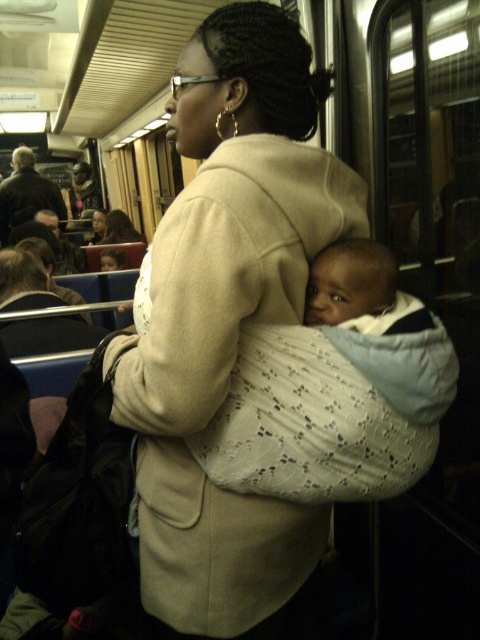
Which is behind, point (8, 214) or point (120, 227)?

The point (120, 227) is behind.

From the picture: Measure the distance between point (3, 196) and camera.

5.16 meters

This screenshot has height=640, width=480. In order to click on matte black backpack at upper left in this screenshot , I will do `click(25, 193)`.

Can you confirm if beige fabric baby carrier at center is wider than matte beige coat at center?

In fact, beige fabric baby carrier at center might be narrower than matte beige coat at center.

Who is higher up, beige fabric baby carrier at center or matte beige coat at center?

Positioned higher is matte beige coat at center.

Who is more forward, (154, 435) or (119, 216)?

Point (154, 435) is more forward.

Where is `beige fabric baby carrier at center`? beige fabric baby carrier at center is located at coordinates (229, 324).

Does point (170, 508) come closer to viewer compared to point (8, 216)?

Yes, point (170, 508) is in front of point (8, 216).

Can you confirm if beige fabric baby carrier at center is positioned to the right of matte black backpack at upper left?

Indeed, beige fabric baby carrier at center is positioned on the right side of matte black backpack at upper left.

Which is behind, point (310, 196) or point (49, 184)?

Point (49, 184)

In order to click on beige fabric baby carrier at center in this screenshot , I will do `click(229, 324)`.